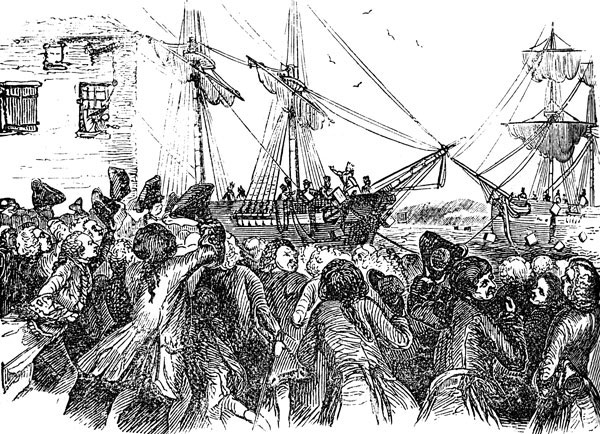
The height and width of the screenshot is (434, 600). Identify the location of boxes. (494, 235), (529, 235), (559, 245), (582, 237), (555, 210), (585, 201), (337, 197), (309, 197), (389, 222).